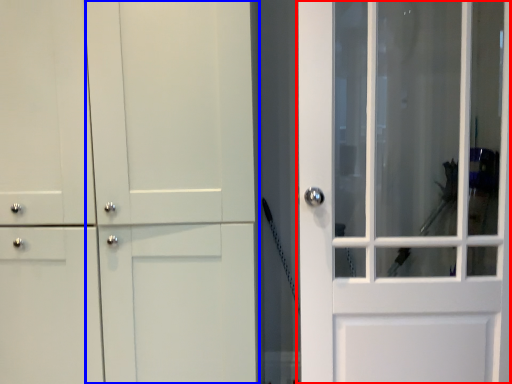
Question: Which object is further to the camera taking this photo, door (highlighted by a red box) or barn door (highlighted by a blue box)?

Choices:
 (A) door
 (B) barn door

Answer: (A)